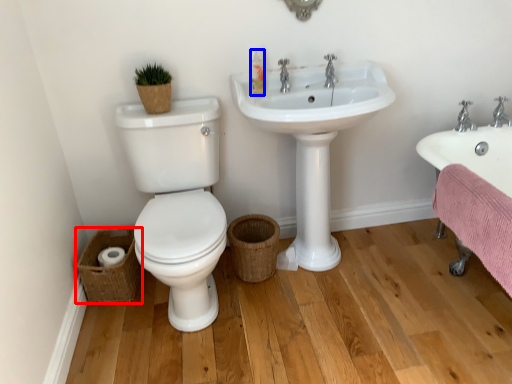
Question: Among these objects, which one is nearest to the camera, basket (highlighted by a red box) or toiletry (highlighted by a blue box)?

Choices:
 (A) basket
 (B) toiletry

Answer: (B)